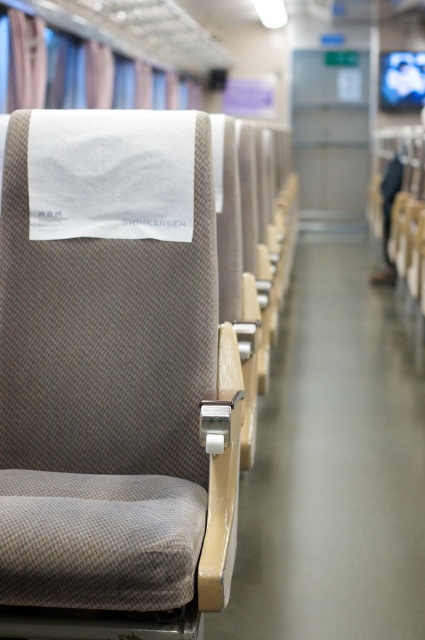
Does textured beige seat at center appear on the right side of blue fabric curtain at upper left?

Yes, textured beige seat at center is to the right of blue fabric curtain at upper left.

Who is more distant from viewer, (198,227) or (104,61)?

Positioned behind is point (104,61).

Locate an element on the screen. textured beige seat at center is located at coordinates (113, 422).